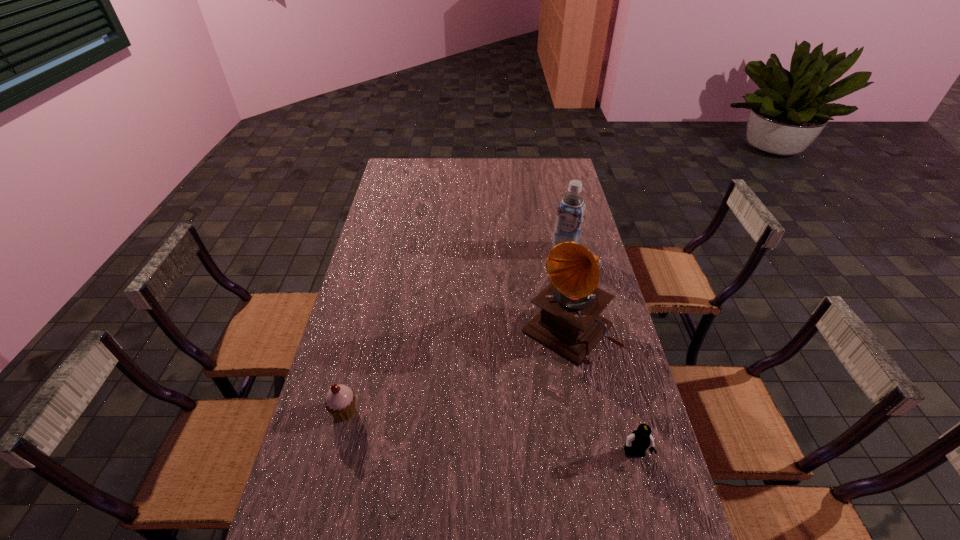
Where is `free region at the near edge`? This screenshot has height=540, width=960. free region at the near edge is located at coordinates (x=570, y=523).

The height and width of the screenshot is (540, 960). What are the coordinates of `free space at the left edge` in the screenshot? It's located at (338, 356).

Where is `free space at the right edge`? The image size is (960, 540). free space at the right edge is located at coordinates (585, 213).

The height and width of the screenshot is (540, 960). Identify the location of free space at the far left corner of the desktop. pos(417,174).

The width and height of the screenshot is (960, 540). What are the coordinates of `vacant area at the near left corner of the desktop` in the screenshot? It's located at (296, 531).

Locate an element on the screen. Image resolution: width=960 pixels, height=540 pixels. empty space between the soya milk and the Lego is located at coordinates (600, 353).

The image size is (960, 540). I want to click on free space that is in between the nearest object and the second nearest object, so click(490, 433).

Locate an element on the screen. The image size is (960, 540). vacant area between the second nearest object and the second farthest object is located at coordinates (456, 370).

Where is `blank region between the cupcake and the third shortest object`? The width and height of the screenshot is (960, 540). blank region between the cupcake and the third shortest object is located at coordinates (455, 331).

This screenshot has height=540, width=960. In order to click on unoccupied area between the leftmost object and the farthest object in this screenshot , I will do `click(455, 331)`.